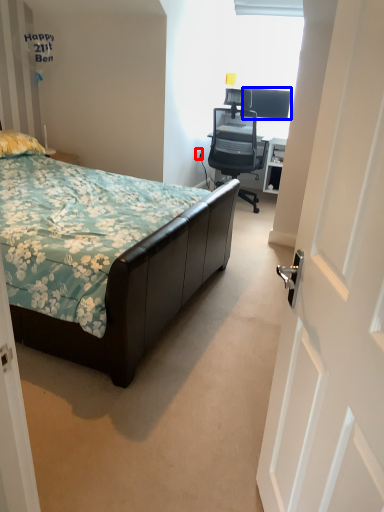
Question: Among these objects, which one is farthest to the camera, power outlet (highlighted by a red box) or television (highlighted by a blue box)?

Choices:
 (A) power outlet
 (B) television

Answer: (A)